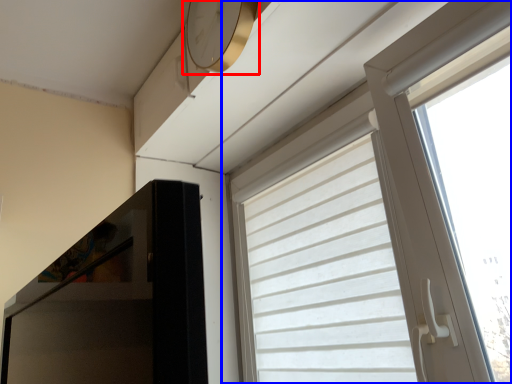
Question: Which object is closer to the camera taking this photo, clock (highlighted by a red box) or window (highlighted by a blue box)?

Choices:
 (A) clock
 (B) window

Answer: (B)